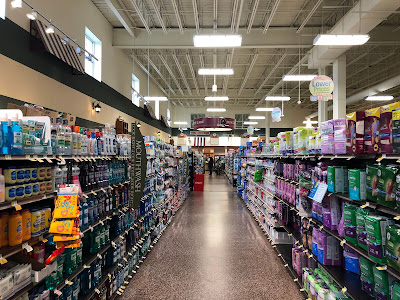
In order to click on shelf in this screenshot , I will do `click(332, 233)`.